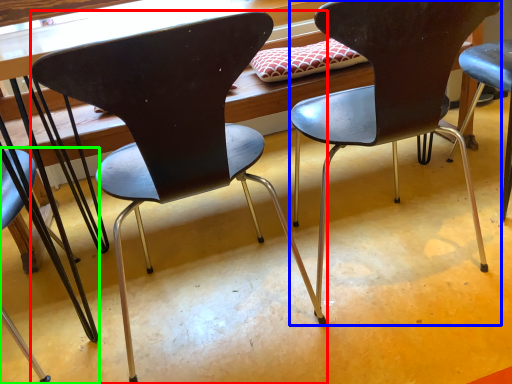
Question: Estimate the real-world distances between objects in this image. Which object is closer to chair (highlighted by a red box), chair (highlighted by a blue box) or chair (highlighted by a green box)?

Choices:
 (A) chair
 (B) chair

Answer: (A)